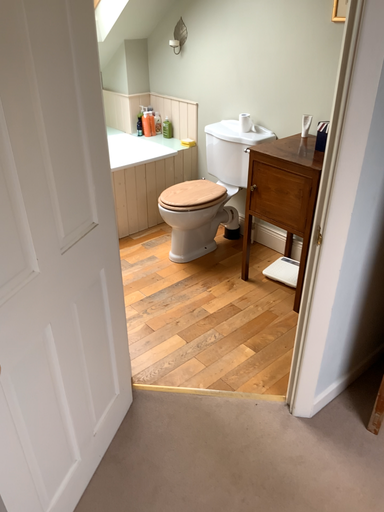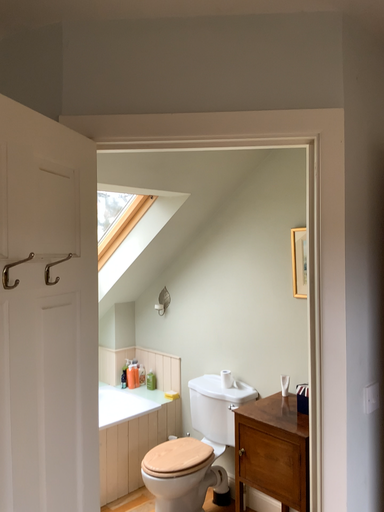
Question: Which way did the camera rotate in the video?

Choices:
 (A) rotated downward
 (B) rotated upward

Answer: (B)